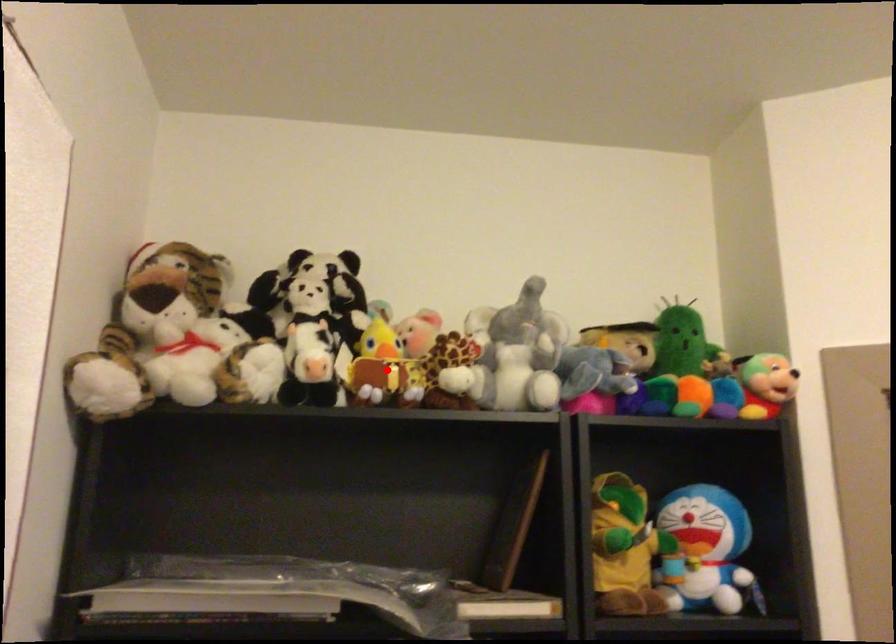
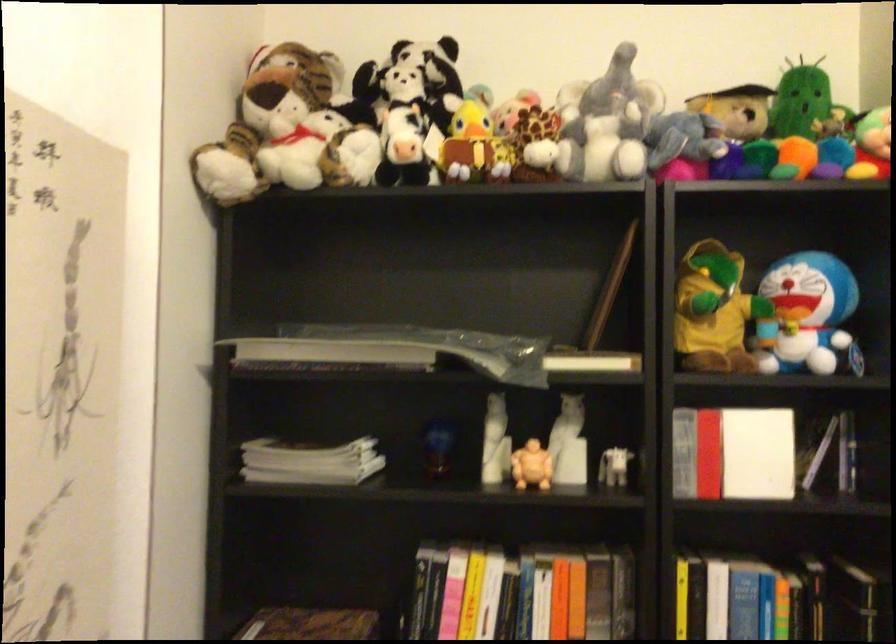
In the second image, find the point that corresponds to the highlighted location in the first image.

(475, 146)